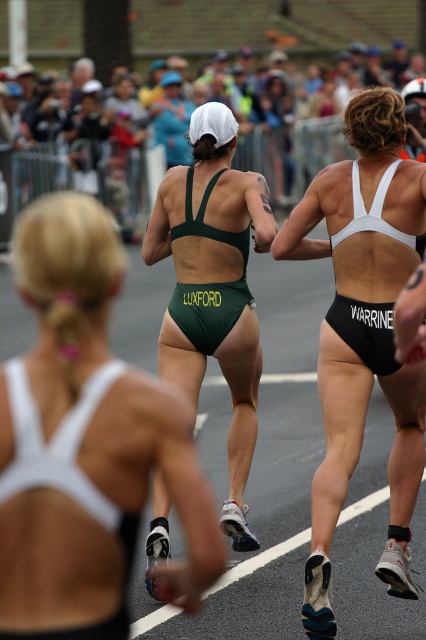
Question: Estimate the real-world distances between objects in this image. Which object is closer to the white matte bikini top at upper center?

Choices:
 (A) white matte sports bra at upper center
 (B) green matte swimsuit at center

Answer: (B)

Question: From the image, what is the correct spatial relationship of white matte sports bra at upper center in relation to white matte bikini top at upper center?

Choices:
 (A) left
 (B) right

Answer: (A)

Question: Can you confirm if white matte bikini top at upper center is positioned to the right of green matte swimsuit at center?

Choices:
 (A) no
 (B) yes

Answer: (B)

Question: Can you confirm if white matte sports bra at upper center is positioned above white matte bikini top at upper center?

Choices:
 (A) no
 (B) yes

Answer: (A)

Question: Which of the following is the closest to the observer?

Choices:
 (A) green matte swimsuit at center
 (B) white matte bikini top at upper center
 (C) white matte sports bra at upper center

Answer: (C)

Question: Which object is closer to the camera taking this photo?

Choices:
 (A) white matte sports bra at upper center
 (B) green matte swimsuit at center

Answer: (A)